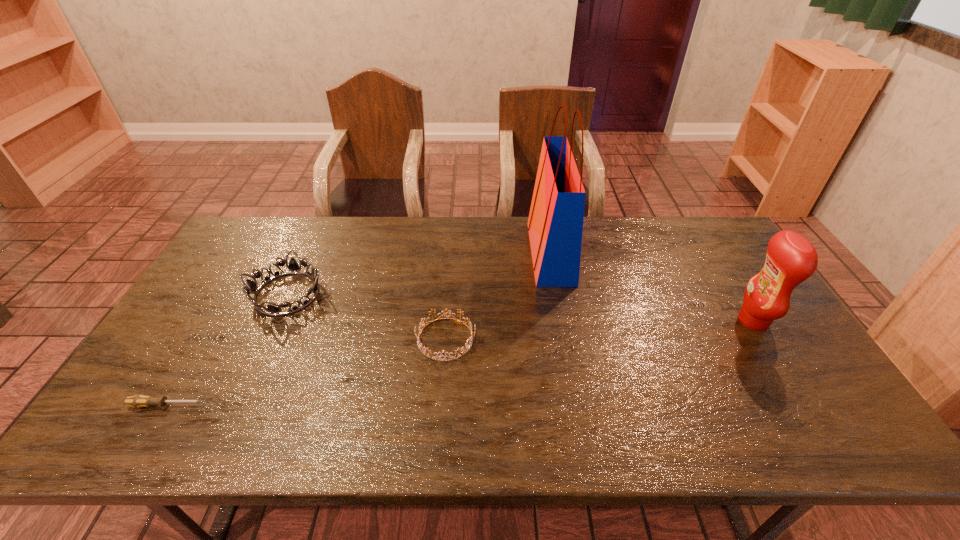
Where is `vacant area that lies between the second object from right to left and the condiment`? The height and width of the screenshot is (540, 960). vacant area that lies between the second object from right to left and the condiment is located at coordinates coord(652,287).

This screenshot has height=540, width=960. Identify the location of empty location between the screwdriver and the rightmost object. (460, 363).

Locate an element on the screen. This screenshot has height=540, width=960. vacant space in between the third object from right to left and the shortest object is located at coordinates (306, 372).

Identify the location of vacant region between the rightmost object and the shopping bag. The height and width of the screenshot is (540, 960). (652, 287).

Locate an element on the screen. The width and height of the screenshot is (960, 540). blank region between the nearest object and the tallest object is located at coordinates (358, 329).

The width and height of the screenshot is (960, 540). I want to click on vacant area that lies between the condiment and the right tiara, so click(599, 330).

Where is `vacant area that lies between the second shortest object and the left tiara`? The height and width of the screenshot is (540, 960). vacant area that lies between the second shortest object and the left tiara is located at coordinates (367, 316).

Find the location of a particular element. free space between the shorter tiara and the fourth shortest object is located at coordinates (599, 330).

At what (x,y) coordinates should I click in order to perform the action: click on object that is the third closest to the shorter tiara. Please return your answer as a coordinate pair (x, y). This screenshot has height=540, width=960. Looking at the image, I should click on (138, 401).

Image resolution: width=960 pixels, height=540 pixels. Identify the location of object that stands as the second closest to the condiment. (425, 350).